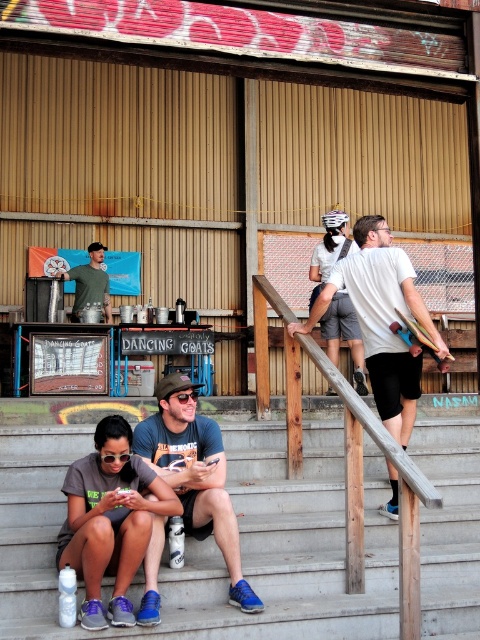
Based on the photo, you are a photographer trying to capture a closeup of the wooden skateboard at upper right without including the matte blue shorts at lower center in the frame. Given their sizes, is this feasible?

The matte blue shorts at lower center has a larger size compared to wooden skateboard at upper right. Therefore, it might be challenging to exclude the matte blue shorts at lower center from the frame if they are positioned closer to the camera, but if the skateboard is placed further away or the camera angle is adjusted to focus solely on the skateboard, it could be possible.

You are standing at the point labeled point [254,502] and want to reach the wooden staircase leading up to the platform. The distance between you and the staircase is 7.52 meters. If you walk straight towards the staircase, will you pass by the person wearing a dark green cap and sunglasses?

Yes, you will pass by the person wearing a dark green cap and sunglasses because they are 7.52 meters away from the point labeled point [254,502], which is the same distance as the staircase. This suggests they are along the path towards the staircase.